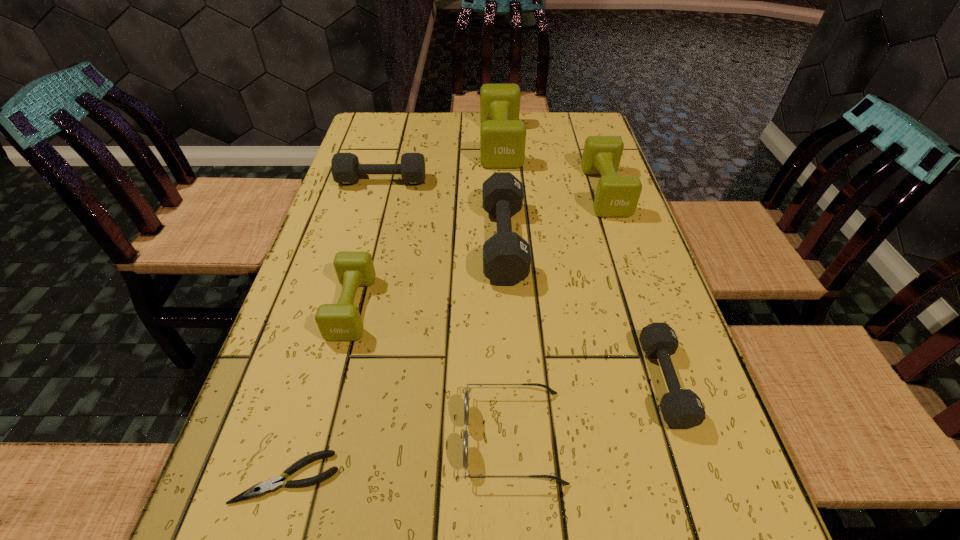
Where is `free space located on the front-facing side of the sunglasses`? This screenshot has width=960, height=540. free space located on the front-facing side of the sunglasses is located at coordinates (238, 436).

Find the location of `vacant space situated on the front-facing side of the sunglasses`. vacant space situated on the front-facing side of the sunglasses is located at coordinates (434, 436).

What are the coordinates of `vacant area located 0.110m on the right of the pliers` in the screenshot? It's located at (409, 478).

I want to click on object at the far edge, so click(x=502, y=135).

Locate an element on the screen. The width and height of the screenshot is (960, 540). pliers that is at the left edge is located at coordinates (273, 484).

At what (x,y) coordinates should I click in order to perform the action: click on vacant region at the far edge of the desktop. Please return your answer as a coordinate pair (x, y). This screenshot has width=960, height=540. Looking at the image, I should click on [x=447, y=126].

This screenshot has width=960, height=540. In the image, there is a desktop. Identify the location of vacant region at the left edge. (353, 194).

Identify the location of free space at the right edge of the desktop. (607, 307).

Where is `blank space at the far right corner`? Image resolution: width=960 pixels, height=540 pixels. blank space at the far right corner is located at coordinates (584, 120).

Where is `vacant space that is in between the biggest olive dumbbell and the smallest olive dumbbell`? vacant space that is in between the biggest olive dumbbell and the smallest olive dumbbell is located at coordinates (426, 225).